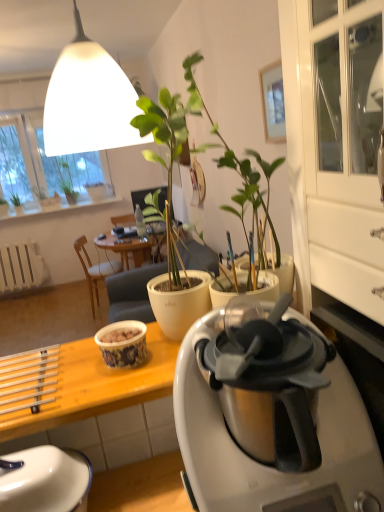
Question: Is the depth of white matte radiator at lower left greater than that of green matte plant at upper left, the third houseplant from the left?

Choices:
 (A) yes
 (B) no

Answer: (B)

Question: Can you confirm if white matte radiator at lower left is positioned to the left of green matte plant at upper left, marked as the 1th houseplant in a right-to-left arrangement?

Choices:
 (A) no
 (B) yes

Answer: (B)

Question: Does white matte radiator at lower left have a lesser height compared to green matte plant at upper left, the third houseplant from the left?

Choices:
 (A) no
 (B) yes

Answer: (A)

Question: Does white matte radiator at lower left have a larger size compared to green matte plant at upper left, marked as the 1th houseplant in a right-to-left arrangement?

Choices:
 (A) yes
 (B) no

Answer: (A)

Question: Does white matte radiator at lower left contain green matte plant at upper left, marked as the 1th houseplant in a right-to-left arrangement?

Choices:
 (A) yes
 (B) no

Answer: (B)

Question: From a real-world perspective, relative to matte ceramic cup at center, is white ceramic window sill at upper left vertically above or below?

Choices:
 (A) above
 (B) below

Answer: (B)

Question: From the image's perspective, is white ceramic window sill at upper left located above or below matte ceramic cup at center?

Choices:
 (A) below
 (B) above

Answer: (B)

Question: In terms of width, does white ceramic window sill at upper left look wider or thinner when compared to matte ceramic cup at center?

Choices:
 (A) thin
 (B) wide

Answer: (B)

Question: Which is correct: white ceramic window sill at upper left is inside matte ceramic cup at center, or outside of it?

Choices:
 (A) outside
 (B) inside

Answer: (A)

Question: In terms of size, does green matte plant at upper left, which is counted as the 2th houseplant, starting from the left, appear bigger or smaller than matte ceramic cup at center?

Choices:
 (A) small
 (B) big

Answer: (B)

Question: Do you think green matte plant at upper left, the 2th houseplant from the right, is within matte ceramic cup at center, or outside of it?

Choices:
 (A) inside
 (B) outside

Answer: (B)

Question: Considering the relative positions of green matte plant at upper left, which is counted as the 2th houseplant, starting from the left, and matte ceramic cup at center in the image provided, is green matte plant at upper left, which is counted as the 2th houseplant, starting from the left, to the left or to the right of matte ceramic cup at center?

Choices:
 (A) left
 (B) right

Answer: (A)

Question: Is green matte plant at upper left, which is counted as the 2th houseplant, starting from the left, taller or shorter than matte ceramic cup at center?

Choices:
 (A) short
 (B) tall

Answer: (B)

Question: Relative to white matte flowerpot at upper center, is white ceramic window sill at upper left in front or behind?

Choices:
 (A) front
 (B) behind

Answer: (A)

Question: From a real-world perspective, relative to white matte flowerpot at upper center, is white ceramic window sill at upper left vertically above or below?

Choices:
 (A) below
 (B) above

Answer: (A)